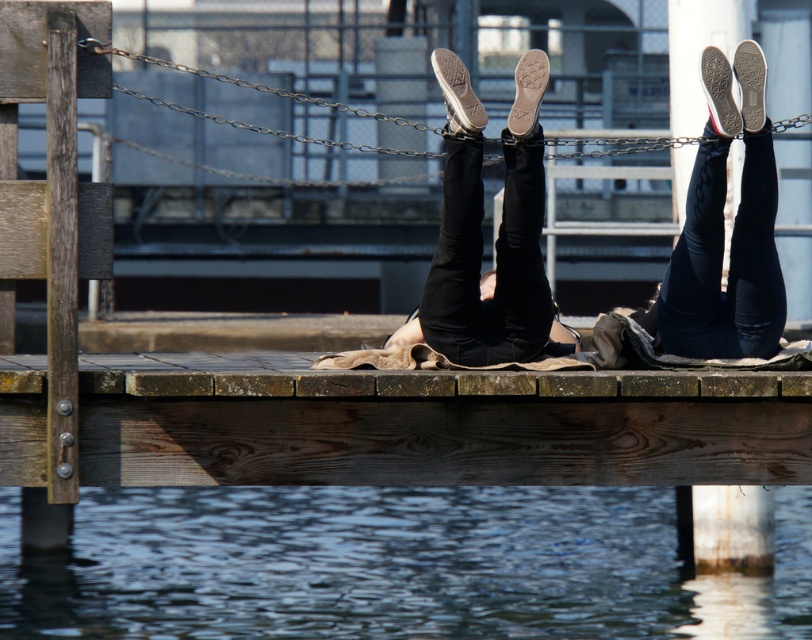
Question: Considering the real-world distances, which object is farthest from the matte black leggings at center?

Choices:
 (A) clear water at lower center
 (B) matte black jeans at center

Answer: (A)

Question: Can you confirm if clear water at lower center is wider than matte black leggings at center?

Choices:
 (A) no
 (B) yes

Answer: (B)

Question: Among these points, which one is farthest from the camera?

Choices:
 (A) (715, 307)
 (B) (443, 275)
 (C) (784, 524)

Answer: (C)

Question: Is clear water at lower center smaller than matte black leggings at center?

Choices:
 (A) yes
 (B) no

Answer: (A)

Question: Which object appears closest to the camera in this image?

Choices:
 (A) matte black jeans at center
 (B) clear water at lower center
 (C) matte black leggings at center

Answer: (A)

Question: Is clear water at lower center to the right of matte black jeans at center from the viewer's perspective?

Choices:
 (A) yes
 (B) no

Answer: (B)